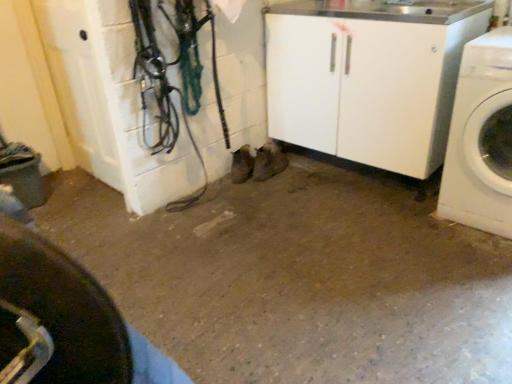
This screenshot has height=384, width=512. I want to click on black rubber tire at lower left, so click(x=63, y=309).

What do you see at coordinates (63, 309) in the screenshot?
I see `black rubber tire at lower left` at bounding box center [63, 309].

What do you see at coordinates (478, 138) in the screenshot? I see `white glossy washing machine at right` at bounding box center [478, 138].

Find the location of `white glossy washing machine at right`. white glossy washing machine at right is located at coordinates (478, 138).

Where is `black rubber tire at lower left`? The width and height of the screenshot is (512, 384). black rubber tire at lower left is located at coordinates (63, 309).

Considering the relative positions of white glossy washing machine at right and black rubber tire at lower left in the image provided, is white glossy washing machine at right to the left of black rubber tire at lower left from the viewer's perspective?

No.

Is white glossy washing machine at right in front of black rubber tire at lower left?

No.

Does point (476, 173) appear closer or farther from the camera than point (108, 367)?

Point (476, 173).

From the image's perspective, is white glossy washing machine at right beneath black rubber tire at lower left?

No, from the image's perspective, white glossy washing machine at right is not beneath black rubber tire at lower left.

From a real-world perspective, is white glossy washing machine at right on black rubber tire at lower left?

Actually, white glossy washing machine at right is physically below black rubber tire at lower left in the real world.

Considering the relative sizes of white glossy washing machine at right and black rubber tire at lower left in the image provided, is white glossy washing machine at right wider than black rubber tire at lower left?

Indeed, white glossy washing machine at right has a greater width compared to black rubber tire at lower left.

Who is taller, white glossy washing machine at right or black rubber tire at lower left?

With more height is white glossy washing machine at right.

Which of these two, white glossy washing machine at right or black rubber tire at lower left, is bigger?

With larger size is white glossy washing machine at right.

Which is correct: white glossy washing machine at right is inside black rubber tire at lower left, or outside of it?

white glossy washing machine at right is located beyond the bounds of black rubber tire at lower left.

Is white glossy washing machine at right far from black rubber tire at lower left?

Absolutely, white glossy washing machine at right is distant from black rubber tire at lower left.

Is white glossy washing machine at right looking in the opposite direction of black rubber tire at lower left?

No.

Measure the distance from white glossy washing machine at right to black rubber tire at lower left.

white glossy washing machine at right is 5.76 feet from black rubber tire at lower left.

I want to click on tire in front of the white glossy washing machine at right, so click(63, 309).

In the image, is black rubber tire at lower left on the left side or the right side of white glossy washing machine at right?

black rubber tire at lower left is to the left of white glossy washing machine at right.

In the image, is black rubber tire at lower left positioned in front of or behind white glossy washing machine at right?

In the image, black rubber tire at lower left appears in front of white glossy washing machine at right.

Does point (8, 253) come behind point (484, 37)?

No, (8, 253) is closer to viewer.

From the image's perspective, does black rubber tire at lower left appear lower than white glossy washing machine at right?

Indeed, from the image's perspective, black rubber tire at lower left is shown beneath white glossy washing machine at right.

From a real-world perspective, is black rubber tire at lower left located higher than white glossy washing machine at right?

Yes, from a real-world perspective, black rubber tire at lower left is over white glossy washing machine at right

Consider the image. Can you confirm if black rubber tire at lower left is wider than white glossy washing machine at right?

No, black rubber tire at lower left is not wider than white glossy washing machine at right.

In terms of height, does black rubber tire at lower left look taller or shorter compared to white glossy washing machine at right?

Considering their sizes, black rubber tire at lower left has less height than white glossy washing machine at right.

Which of these two, black rubber tire at lower left or white glossy washing machine at right, is bigger?

white glossy washing machine at right is bigger.

Would you say white glossy washing machine at right is part of black rubber tire at lower left's contents?

No, black rubber tire at lower left does not contain white glossy washing machine at right.

Based on the photo, would you consider black rubber tire at lower left to be distant from white glossy washing machine at right?

Yes, black rubber tire at lower left and white glossy washing machine at right are quite far apart.

Is black rubber tire at lower left facing towards white glossy washing machine at right?

Yes, black rubber tire at lower left is oriented towards white glossy washing machine at right.

Can you tell me how much black rubber tire at lower left and white glossy washing machine at right differ in facing direction?

176 degrees separate the facing orientations of black rubber tire at lower left and white glossy washing machine at right.

Identify the location of washing machine above the black rubber tire at lower left (from the image's perspective). The height and width of the screenshot is (384, 512). (478, 138).

There is a white glossy washing machine at right. Identify the location of tire above it (from a real-world perspective). (63, 309).

Where is `tire on the left of white glossy washing machine at right`? tire on the left of white glossy washing machine at right is located at coordinates (63, 309).